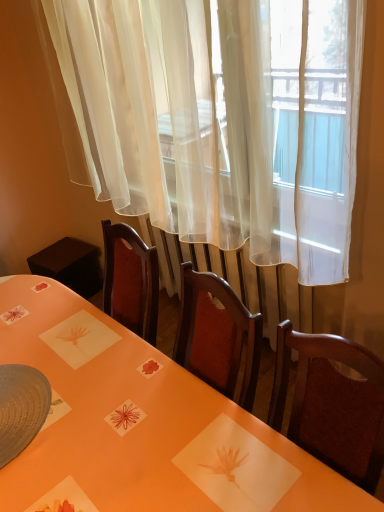
This screenshot has width=384, height=512. Describe the element at coordinates (217, 123) in the screenshot. I see `white sheer curtain at upper center` at that location.

Where is `white sheer curtain at upper center`? This screenshot has height=512, width=384. white sheer curtain at upper center is located at coordinates 217,123.

Describe the element at coordinates (136, 423) in the screenshot. I see `orange glossy table at center` at that location.

The width and height of the screenshot is (384, 512). Find the location of `orange glossy table at center`. orange glossy table at center is located at coordinates (136, 423).

This screenshot has width=384, height=512. Find the location of `white sheer curtain at upper center`. white sheer curtain at upper center is located at coordinates (217, 123).

Is orange glossy table at center at the right side of white sheer curtain at upper center?

Incorrect, orange glossy table at center is not on the right side of white sheer curtain at upper center.

Who is more distant, orange glossy table at center or white sheer curtain at upper center?

white sheer curtain at upper center is behind.

Is point (120, 500) in front of point (338, 87)?

That is True.

From the image's perspective, which one is positioned higher, orange glossy table at center or white sheer curtain at upper center?

white sheer curtain at upper center appears higher in the image.

From a real-world perspective, is orange glossy table at center physically below white sheer curtain at upper center?

Yes, from a real-world perspective, orange glossy table at center is below white sheer curtain at upper center.

Considering the sizes of orange glossy table at center and white sheer curtain at upper center in the image, is orange glossy table at center wider or thinner than white sheer curtain at upper center?

Clearly, orange glossy table at center has more width compared to white sheer curtain at upper center.

Between orange glossy table at center and white sheer curtain at upper center, which one has more height?

With more height is white sheer curtain at upper center.

Is orange glossy table at center smaller than white sheer curtain at upper center?

Actually, orange glossy table at center might be larger than white sheer curtain at upper center.

Can we say orange glossy table at center lies outside white sheer curtain at upper center?

Indeed, orange glossy table at center is completely outside white sheer curtain at upper center.

Is orange glossy table at center in contact with white sheer curtain at upper center?

No, orange glossy table at center is not next to white sheer curtain at upper center.

Could you tell me if orange glossy table at center is turned towards white sheer curtain at upper center?

No, orange glossy table at center is not aimed at white sheer curtain at upper center.

How many degrees apart are the facing directions of orange glossy table at center and white sheer curtain at upper center?

orange glossy table at center and white sheer curtain at upper center are facing 0.211 degrees away from each other.

Measure the distance between orange glossy table at center and white sheer curtain at upper center.

orange glossy table at center is 28.59 inches from white sheer curtain at upper center.

You are a GUI agent. You are given a task and a screenshot of the screen. Output one action in this format:
    pyautogui.click(x=<x>, y=<y>)
    Task: Click on the table located below the white sheer curtain at upper center (from the image's perspective)
    The height and width of the screenshot is (512, 384).
    Given the screenshot: What is the action you would take?
    [x=136, y=423]

From the picture: Considering the positions of objects white sheer curtain at upper center and orange glossy table at center in the image provided, who is more to the left, white sheer curtain at upper center or orange glossy table at center?

Positioned to the left is orange glossy table at center.

Which object is more forward, white sheer curtain at upper center or orange glossy table at center?

orange glossy table at center is more forward.

Considering the positions of points (359, 36) and (52, 432), is point (359, 36) closer to camera compared to point (52, 432)?

Yes, point (359, 36) is in front of point (52, 432).

From the image's perspective, does white sheer curtain at upper center appear lower than orange glossy table at center?

Incorrect, from the image's perspective, white sheer curtain at upper center is higher than orange glossy table at center.

From a real-world perspective, which is physically below, white sheer curtain at upper center or orange glossy table at center?

orange glossy table at center is physically lower.

Is white sheer curtain at upper center wider than orange glossy table at center?

No, white sheer curtain at upper center is not wider than orange glossy table at center.

In terms of height, does white sheer curtain at upper center look taller or shorter compared to orange glossy table at center?

Clearly, white sheer curtain at upper center is taller compared to orange glossy table at center.

Does white sheer curtain at upper center have a larger size compared to orange glossy table at center?

No, white sheer curtain at upper center is not bigger than orange glossy table at center.

Is orange glossy table at center inside white sheer curtain at upper center?

No, orange glossy table at center is not a part of white sheer curtain at upper center.

Is white sheer curtain at upper center directly adjacent to orange glossy table at center?

white sheer curtain at upper center and orange glossy table at center are clearly separated.

Is white sheer curtain at upper center oriented towards orange glossy table at center?

No.

Can you tell me how much white sheer curtain at upper center and orange glossy table at center differ in facing direction?

There is a 0.211-degree angle between the facing directions of white sheer curtain at upper center and orange glossy table at center.

Locate an element on the screen. The height and width of the screenshot is (512, 384). table located in front of the white sheer curtain at upper center is located at coordinates (136, 423).

This screenshot has height=512, width=384. Find the location of `curtain located behind the orange glossy table at center`. curtain located behind the orange glossy table at center is located at coordinates (217, 123).

Where is `table beneath the white sheer curtain at upper center (from a real-world perspective)`? The image size is (384, 512). table beneath the white sheer curtain at upper center (from a real-world perspective) is located at coordinates (136, 423).